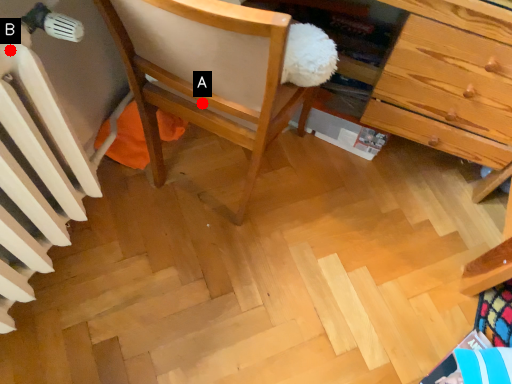
Question: Two points are circled on the image, labeled by A and B beside each circle. Which point is closer to the camera?

Choices:
 (A) A is closer
 (B) B is closer

Answer: (B)